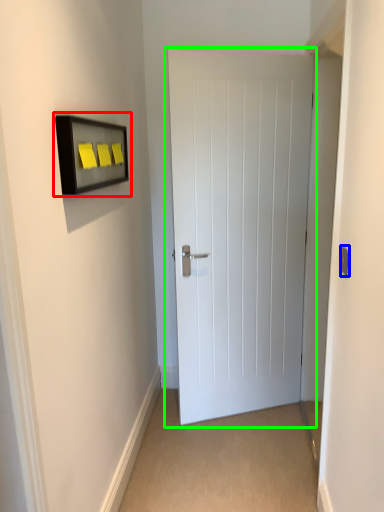
Question: Based on their relative distances, which object is farther from medicine cabinet (highlighted by a red box)? Choose from light switch (highlighted by a blue box) and door (highlighted by a green box).

Choices:
 (A) light switch
 (B) door

Answer: (A)